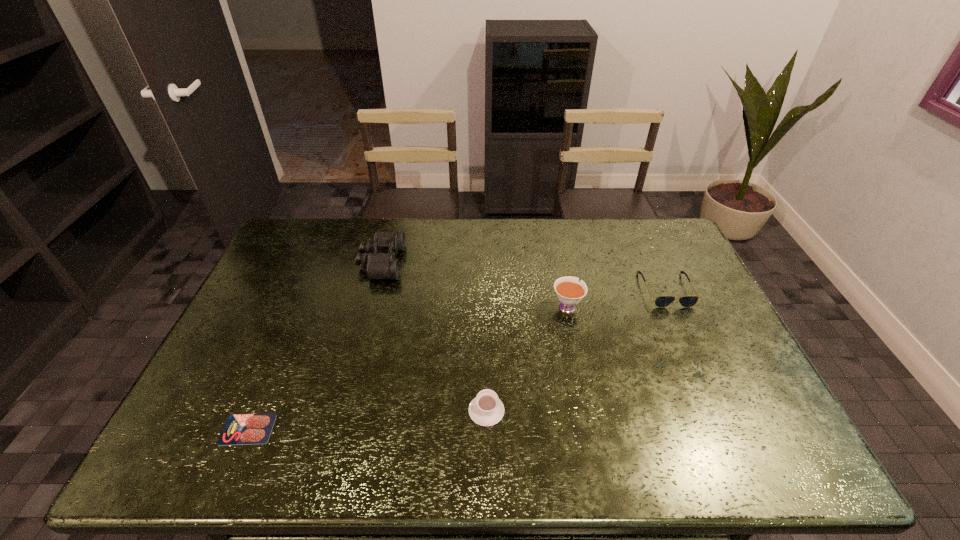
At what (x,y) coordinates should I click in order to perform the action: click on binoculars. Please return your answer as a coordinate pair (x, y). Looking at the image, I should click on (381, 263).

Where is `the fourth object from left to right`? This screenshot has width=960, height=540. the fourth object from left to right is located at coordinates point(569,291).

Find the location of a particular element. the taller teacup is located at coordinates (569, 291).

Where is `sunglasses`? sunglasses is located at coordinates (662, 301).

Where is `the left teacup`? The height and width of the screenshot is (540, 960). the left teacup is located at coordinates pos(486,409).

Locate an element on the screen. Image resolution: width=960 pixels, height=540 pixels. the third object from left to right is located at coordinates (486, 409).

Locate an element on the screen. Image resolution: width=960 pixels, height=540 pixels. the shortest object is located at coordinates (241, 429).

What are the coordinates of `salami` in the screenshot? It's located at (x=241, y=429).

This screenshot has width=960, height=540. I want to click on free space located 0.400m at the eyepieces of the fourth object from right to left, so click(519, 262).

Identify the location of vacant space located on the side of the taller teacup with the handle. (556, 253).